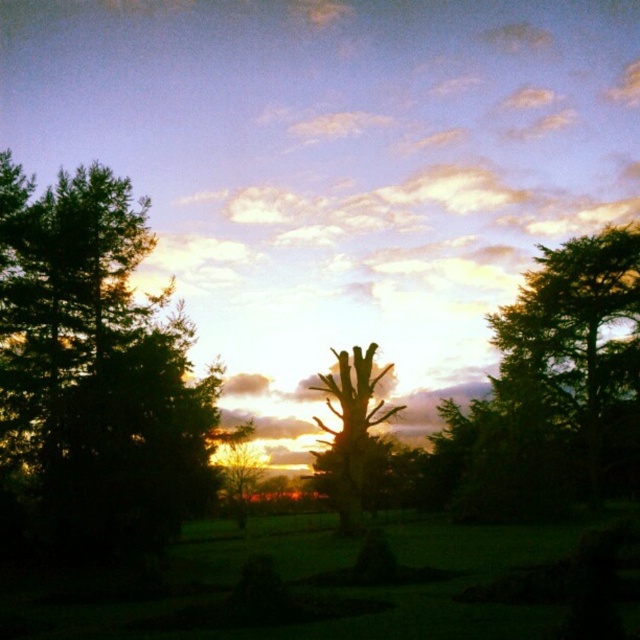
Between dark green leafy tree at left and green leafy tree at center, which one has less height?

green leafy tree at center is shorter.

Can you confirm if dark green leafy tree at left is wider than green leafy tree at center?

Indeed, dark green leafy tree at left has a greater width compared to green leafy tree at center.

In order to click on dark green leafy tree at left in this screenshot , I will do `click(93, 376)`.

From the picture: Can you confirm if silhouette wood tree at center is thinner than green leafy tree at center?

No, silhouette wood tree at center is not thinner than green leafy tree at center.

Who is more forward, (x=368, y=401) or (x=243, y=497)?

Point (x=368, y=401) is more forward.

This screenshot has width=640, height=640. Describe the element at coordinates (349, 429) in the screenshot. I see `silhouette wood tree at center` at that location.

Identify the location of silhouette wood tree at center. (349, 429).

Identify the location of white fluffy cloud at upper center. (337, 168).

Is point (333, 339) less distant than point (1, 371)?

No, (333, 339) is further to viewer.

Is point (540, 227) positioned behind point (86, 397)?

Yes, it is behind point (86, 397).

Locate an element on the screen. The height and width of the screenshot is (640, 640). white fluffy cloud at upper center is located at coordinates (337, 168).